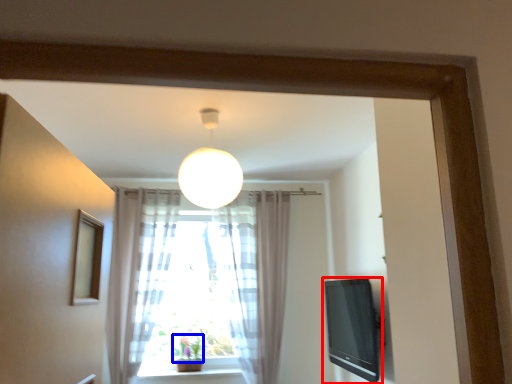
Question: Which object is further to the camera taking this photo, television (highlighted by a red box) or plant (highlighted by a blue box)?

Choices:
 (A) television
 (B) plant

Answer: (B)